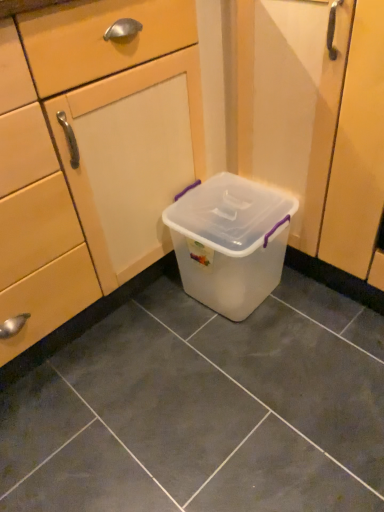
Question: Considering the relative sizes of transparent plastic container at center and transparent plastic storage box at center in the image provided, is transparent plastic container at center smaller than transparent plastic storage box at center?

Choices:
 (A) yes
 (B) no

Answer: (B)

Question: Considering the relative positions of transparent plastic container at center and transparent plastic storage box at center in the image provided, is transparent plastic container at center to the right of transparent plastic storage box at center from the viewer's perspective?

Choices:
 (A) yes
 (B) no

Answer: (B)

Question: Is transparent plastic container at center in front of transparent plastic storage box at center?

Choices:
 (A) no
 (B) yes

Answer: (B)

Question: Considering the relative sizes of transparent plastic container at center and transparent plastic storage box at center in the image provided, is transparent plastic container at center thinner than transparent plastic storage box at center?

Choices:
 (A) no
 (B) yes

Answer: (A)

Question: Does transparent plastic container at center have a larger size compared to transparent plastic storage box at center?

Choices:
 (A) yes
 (B) no

Answer: (A)

Question: Is transparent plastic container at center outside of transparent plastic storage box at center?

Choices:
 (A) no
 (B) yes

Answer: (B)

Question: Is transparent plastic storage box at center aimed at translucent plastic container at center?

Choices:
 (A) yes
 (B) no

Answer: (A)

Question: From the image's perspective, is transparent plastic storage box at center below translucent plastic container at center?

Choices:
 (A) no
 (B) yes

Answer: (A)

Question: Is transparent plastic storage box at center in front of translucent plastic container at center?

Choices:
 (A) yes
 (B) no

Answer: (B)

Question: Is transparent plastic storage box at center next to translucent plastic container at center and touching it?

Choices:
 (A) yes
 (B) no

Answer: (B)

Question: From a real-world perspective, is transparent plastic storage box at center over translucent plastic container at center?

Choices:
 (A) no
 (B) yes

Answer: (B)

Question: Does transparent plastic storage box at center appear on the right side of translucent plastic container at center?

Choices:
 (A) yes
 (B) no

Answer: (A)

Question: Can you confirm if translucent plastic container at center is smaller than transparent plastic container at center?

Choices:
 (A) no
 (B) yes

Answer: (B)